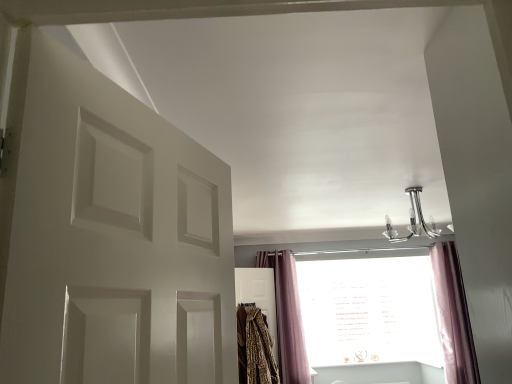
Question: Does chrome metallic chandelier at upper center appear on the left side of white matte door at left?

Choices:
 (A) yes
 (B) no

Answer: (B)

Question: Is chrome metallic chandelier at upper center in contact with white matte door at left?

Choices:
 (A) no
 (B) yes

Answer: (A)

Question: Would you say chrome metallic chandelier at upper center is outside white matte door at left?

Choices:
 (A) yes
 (B) no

Answer: (A)

Question: From the image's perspective, is chrome metallic chandelier at upper center over white matte door at left?

Choices:
 (A) no
 (B) yes

Answer: (A)

Question: Can you confirm if chrome metallic chandelier at upper center is shorter than white matte door at left?

Choices:
 (A) no
 (B) yes

Answer: (B)

Question: In the image, is leopard print blanket at center positioned in front of or behind white matte door at left?

Choices:
 (A) behind
 (B) front

Answer: (A)

Question: In the image, is leopard print blanket at center on the left side or the right side of white matte door at left?

Choices:
 (A) right
 (B) left

Answer: (A)

Question: From a real-world perspective, is leopard print blanket at center positioned above or below white matte door at left?

Choices:
 (A) above
 (B) below

Answer: (B)

Question: Is point (254, 347) positioned closer to the camera than point (196, 370)?

Choices:
 (A) closer
 (B) farther

Answer: (B)

Question: In terms of size, does pink velvet curtain at lower right, the second curtain from the left, appear bigger or smaller than white matte door at left?

Choices:
 (A) big
 (B) small

Answer: (A)

Question: Relative to white matte door at left, is pink velvet curtain at lower right, which appears as the 1th curtain when viewed from the right, in front or behind?

Choices:
 (A) front
 (B) behind

Answer: (B)

Question: Is pink velvet curtain at lower right, the second curtain from the left, taller or shorter than white matte door at left?

Choices:
 (A) tall
 (B) short

Answer: (A)

Question: Is point (446, 306) positioned closer to the camera than point (34, 319)?

Choices:
 (A) farther
 (B) closer

Answer: (A)

Question: Considering the positions of point (281, 289) and point (458, 362), is point (281, 289) closer or farther from the camera than point (458, 362)?

Choices:
 (A) farther
 (B) closer

Answer: (A)

Question: Is purple velvet curtain at lower right, positioned as the first curtain in left-to-right order, taller or shorter than pink velvet curtain at lower right, the second curtain from the left?

Choices:
 (A) short
 (B) tall

Answer: (A)